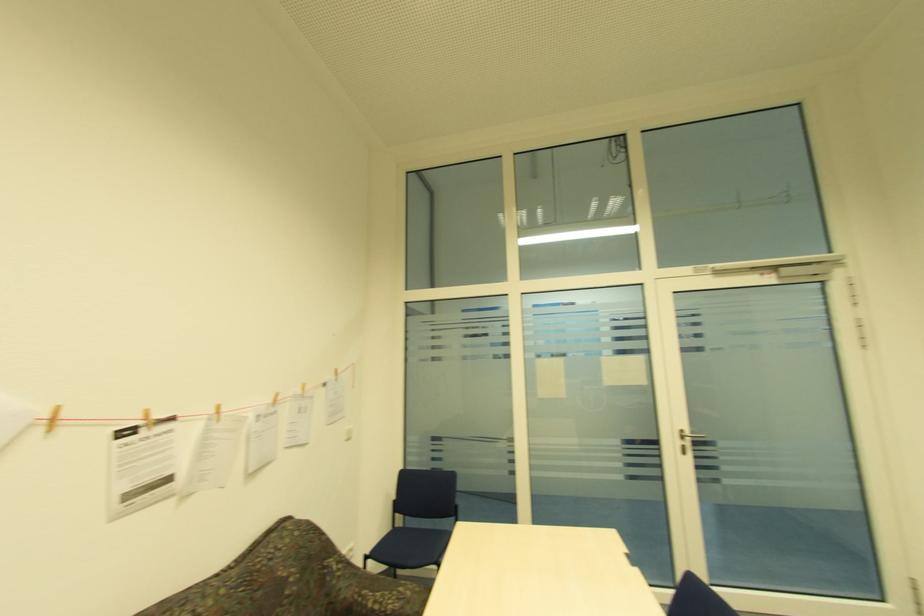
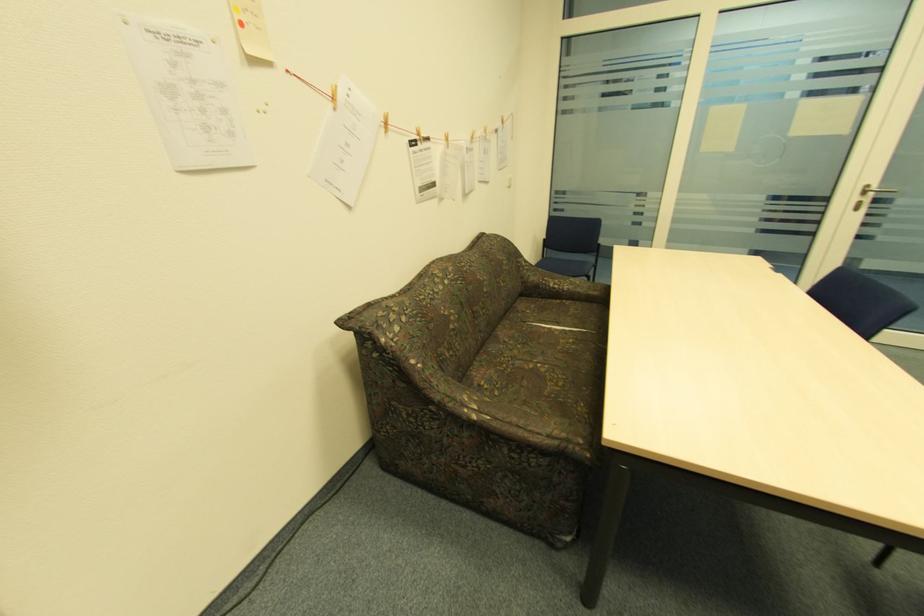
First-person continuous shooting, in which direction is the camera rotating?

The rotation direction of the camera is left-down.